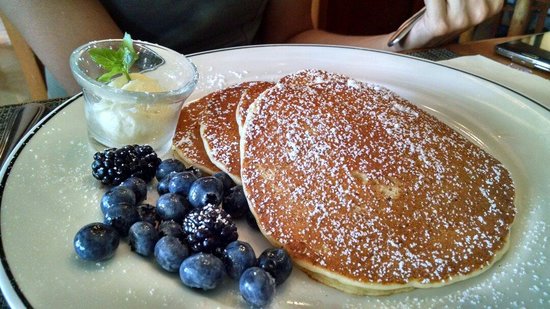
I want to click on scoop of butter in small glass container, so click(x=143, y=80).